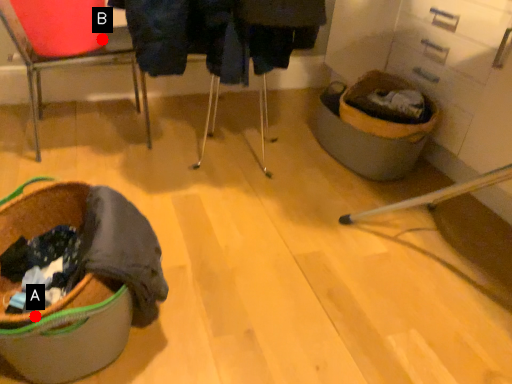
Question: Two points are circled on the image, labeled by A and B beside each circle. Among these points, which one is nearest to the camera?

Choices:
 (A) A is closer
 (B) B is closer

Answer: (A)